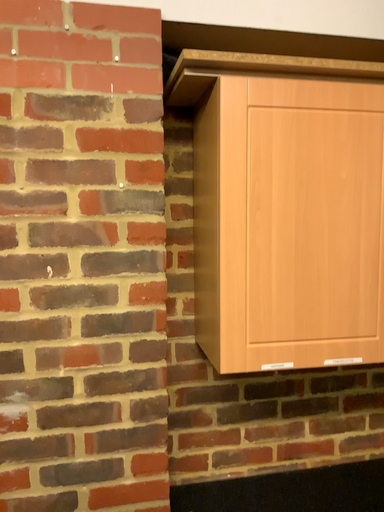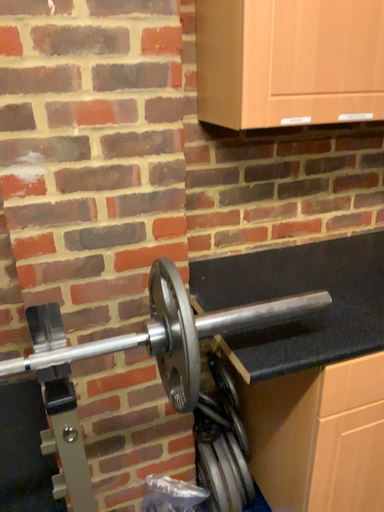
Question: Which way did the camera rotate in the video?

Choices:
 (A) rotated right
 (B) rotated left

Answer: (A)